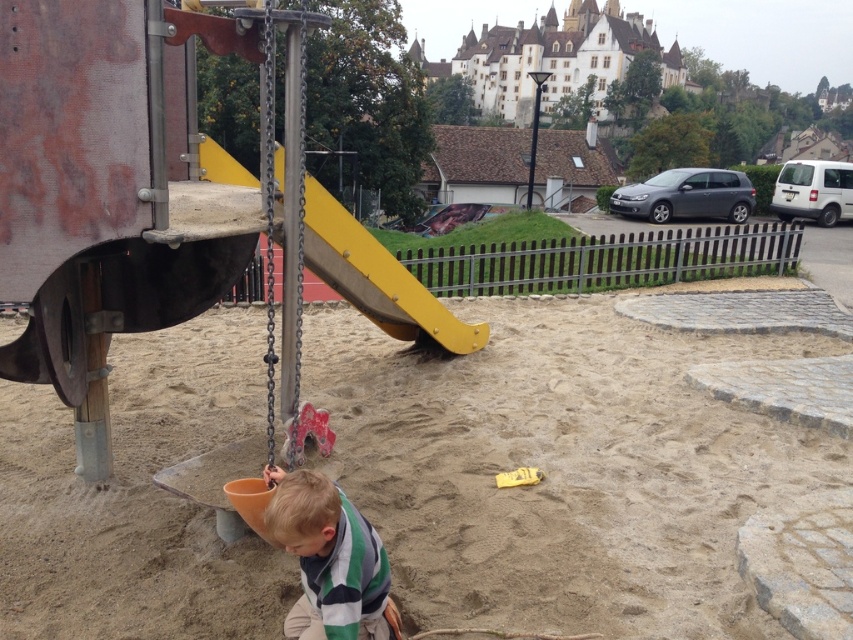
You are a parent trying to ensure your child stays within a safe distance from the playground equipment. According to the image, how far apart are the green striped shirt at center and the yellow matte slide at center?

The green striped shirt at center and the yellow matte slide at center are 3.51 meters apart.

You are a photographer standing at the edge of the playground. You want to take a photo that includes both the point at coordinates point (41, 632) and point (465, 330). Which point will appear larger in your photo?

Point (41, 632) is closer to the camera than point (465, 330), so it will appear larger in the photo.